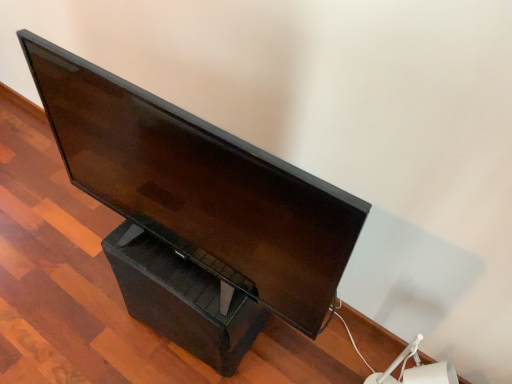
Find the location of a particular element. blank space above black plastic drawer at lower center (from a real-world perspective) is located at coordinates (170, 254).